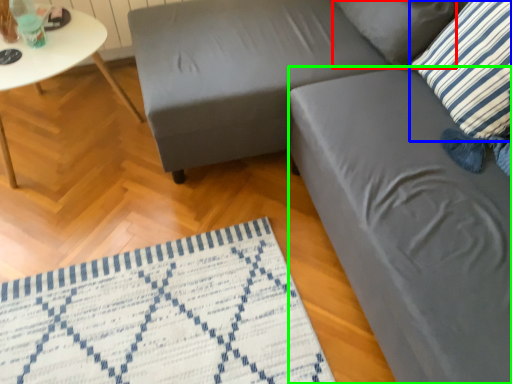
Question: Estimate the real-world distances between objects in this image. Which object is farther from pillow (highlighted by a red box), pillow (highlighted by a blue box) or swivel chair (highlighted by a green box)?

Choices:
 (A) pillow
 (B) swivel chair

Answer: (B)